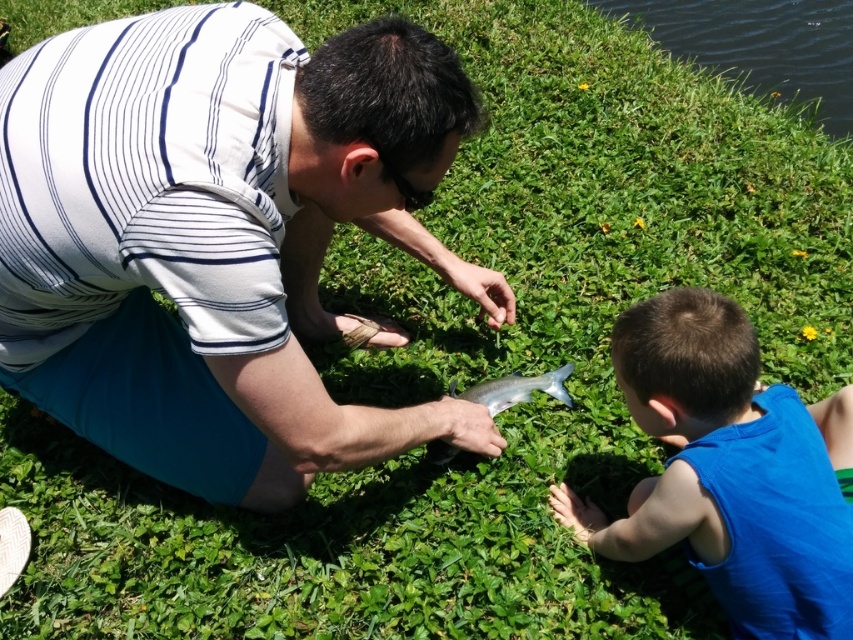
You are a photographer trying to capture the child in the bright blue sleeveless shirt. The scene has a point marked at coordinates [726,472] which indicates the location of the blue matte shirt at lower right. Based on this information, where should you position your camera to ensure the child in the bright blue sleeveless shirt is in the frame?

The point at [726,472] marks the blue matte shirt at lower right, so positioning the camera near that coordinate will ensure the child in the bright blue sleeveless shirt is captured in the frame.